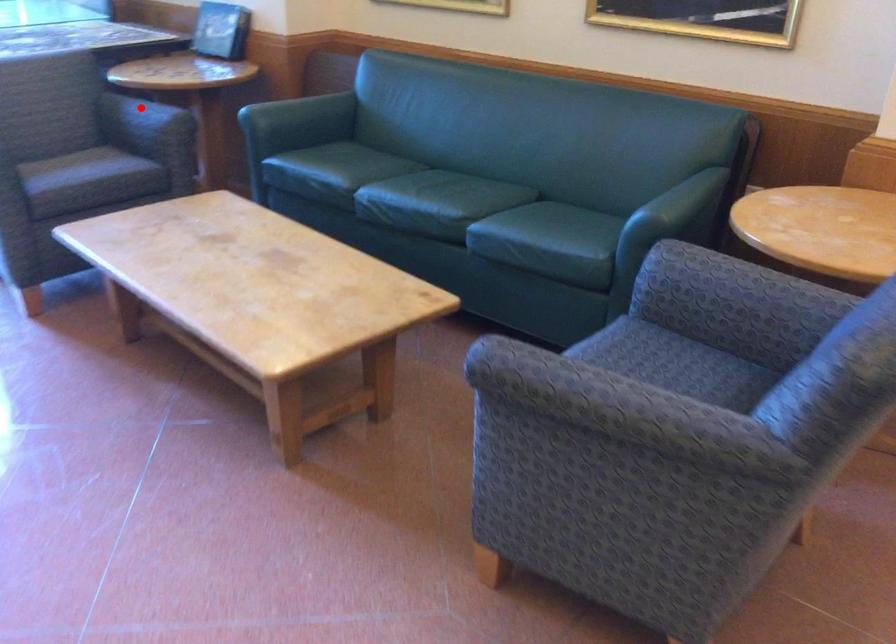
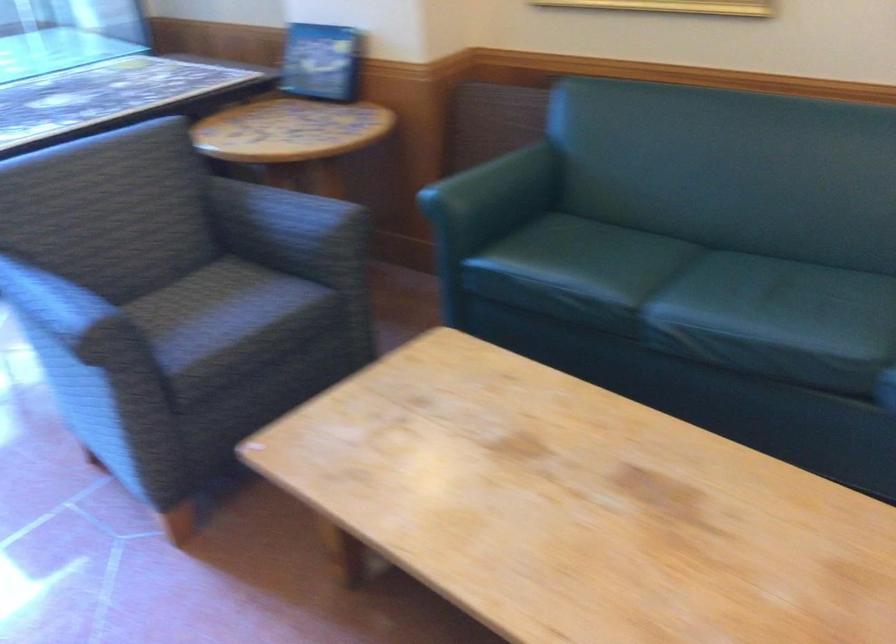
Question: A red point is marked in image1. In image2, is the corresponding 3D point closer to the camera or farther? Reply with the corresponding letter.

Choices:
 (A) The corresponding 3D point is closer.
 (B) The corresponding 3D point is farther.

Answer: (A)